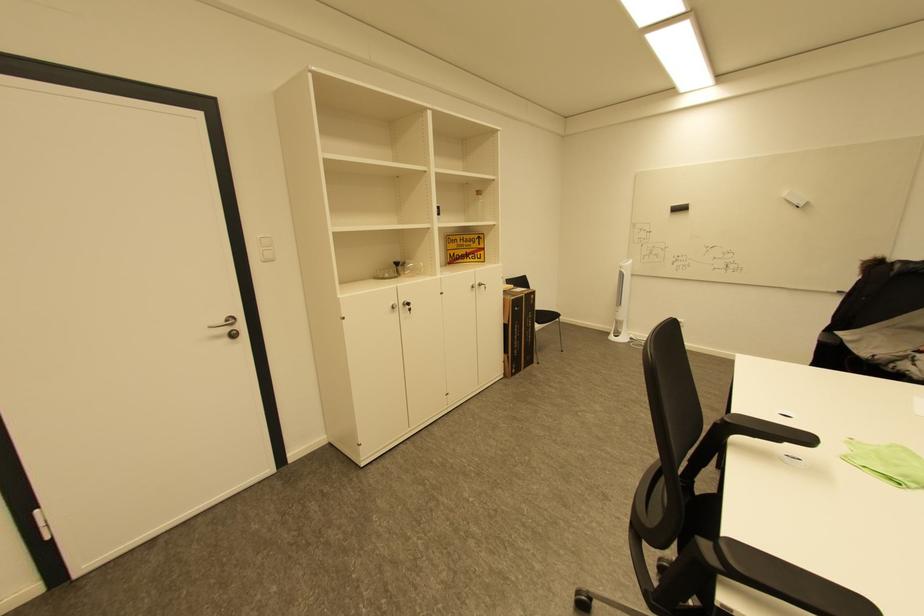
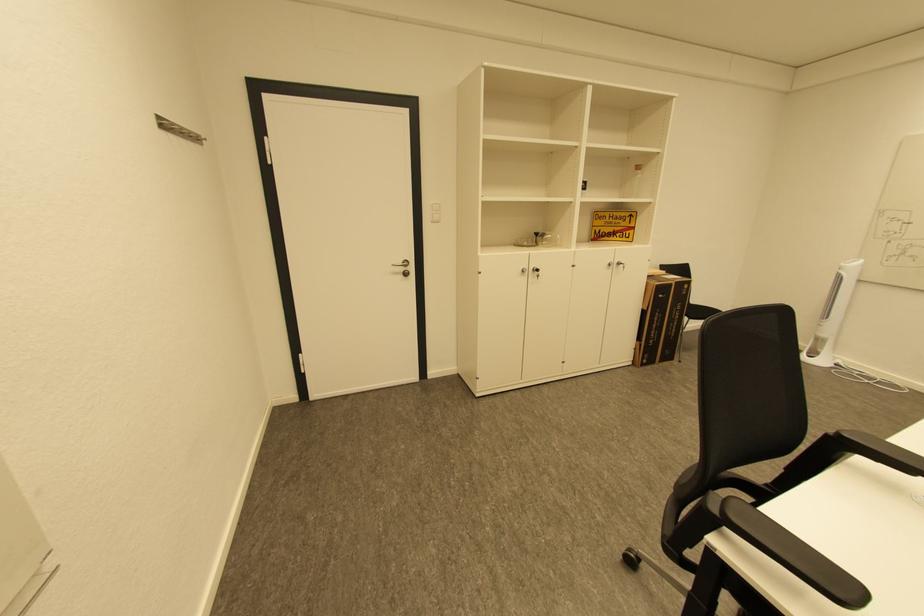
The point at (403, 264) is marked in the first image. Where is the corresponding point in the second image?

(543, 235)